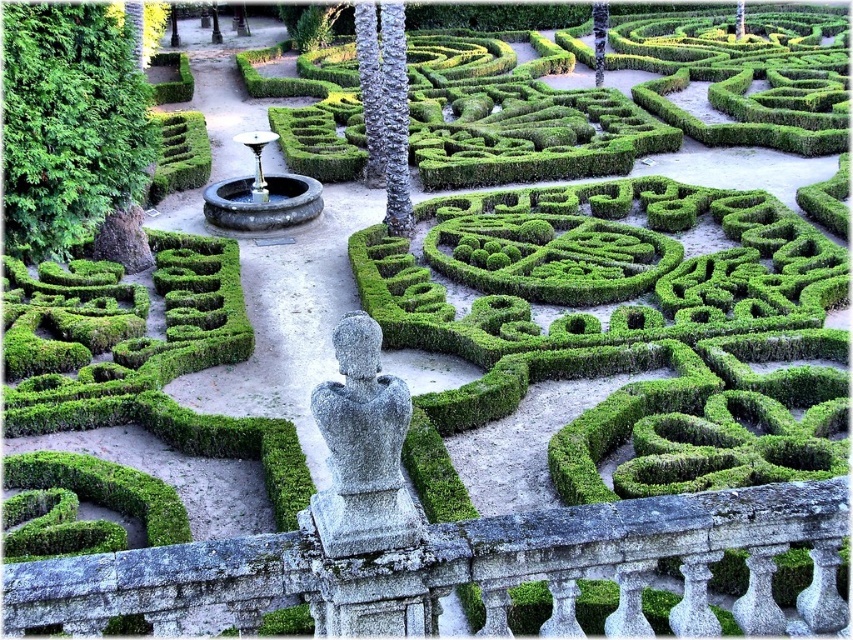
You are a visitor standing at the entrance of the garden maze. You see the gray stone statue at center and the black stone fountain at center. Which object is positioned to the right of the other?

The gray stone statue at center is to the right of the black stone fountain at center.

You are a gardener who wants to place a new decorative item between the green leafy bush at left and the black stone fountain at center. The decorative item is 1 meter wide. Can it fit between them?

The green leafy bush at left is thinner than the black stone fountain at center, so the space between them may accommodate the decorative item. However, the exact width isn not specified, so it depends on the actual distance between them.

Consider the image. You are a visitor standing at the entrance of the garden maze. You see the gray stone statue at center and the black stone fountain at center. Which object is nearer to you?

The gray stone statue at center is closer to the viewer than the black stone fountain at center.